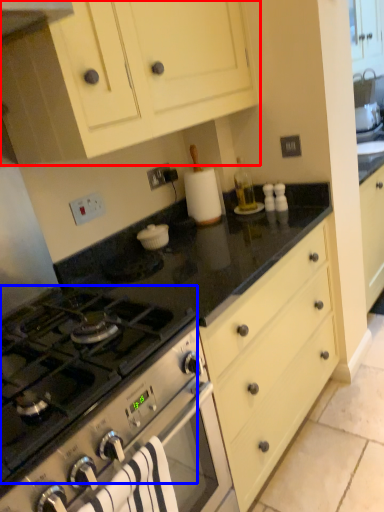
Question: Which object appears farthest to the camera in this image, cabinetry (highlighted by a red box) or gas stove (highlighted by a blue box)?

Choices:
 (A) cabinetry
 (B) gas stove

Answer: (A)